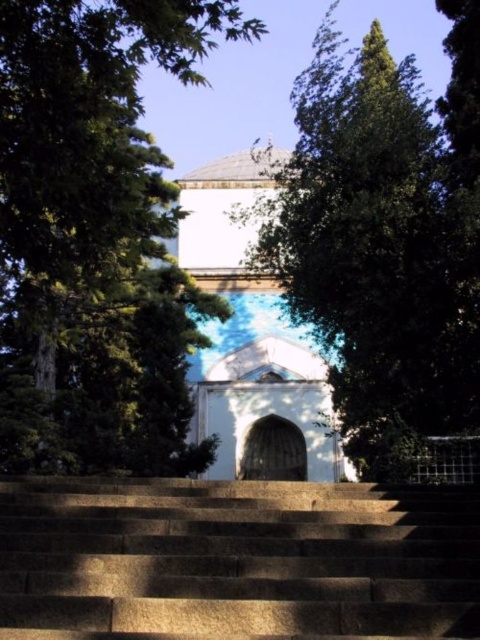
Question: Which object is farther from the camera taking this photo?

Choices:
 (A) brown stone stairs at center
 (B) green leafy tree at center
 (C) white marble chapel at center
 (D) green leafy tree at upper center

Answer: (C)

Question: Is brown stone stairs at center to the left of white marble chapel at center from the viewer's perspective?

Choices:
 (A) yes
 (B) no

Answer: (B)

Question: Is green leafy tree at upper center to the left of white marble chapel at center from the viewer's perspective?

Choices:
 (A) no
 (B) yes

Answer: (B)

Question: Can you confirm if green leafy tree at upper center is smaller than green leafy tree at center?

Choices:
 (A) yes
 (B) no

Answer: (B)

Question: Among these points, which one is farthest from the camera?

Choices:
 (A) (387, 248)
 (B) (104, 604)
 (C) (236, 252)
 (D) (107, 262)

Answer: (C)

Question: Which object appears closest to the camera in this image?

Choices:
 (A) brown stone stairs at center
 (B) green leafy tree at upper center

Answer: (A)